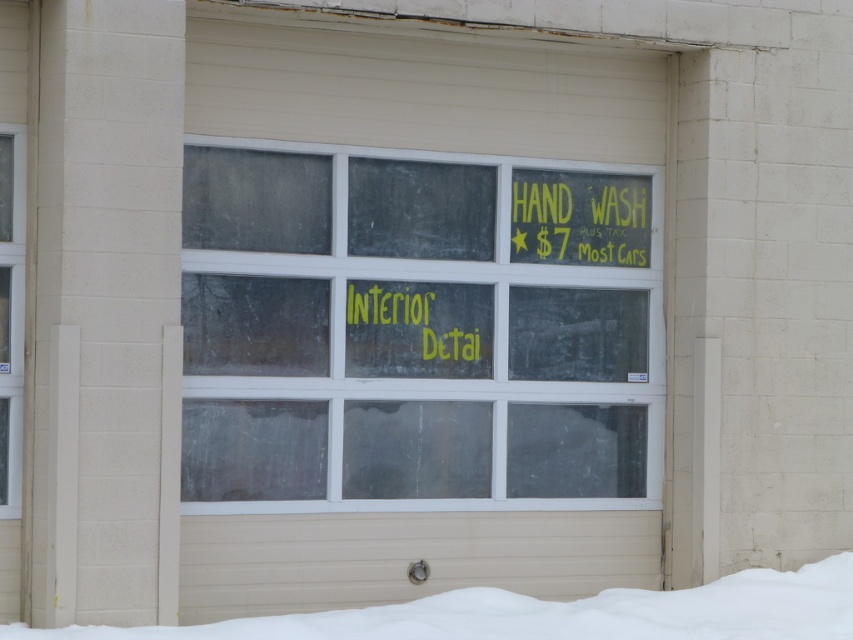
Question: Based on their relative distances, which object is nearer to the white fluffy snow at bottom?

Choices:
 (A) transparent glass window at center
 (B) yellow chalky sign at center
 (C) clear glass door at left
 (D) yellow chalkboard sign at upper right

Answer: (A)

Question: Is transparent glass window at center closer to the viewer compared to white fluffy snow at bottom?

Choices:
 (A) yes
 (B) no

Answer: (B)

Question: Is white fluffy snow at bottom smaller than yellow chalky sign at center?

Choices:
 (A) yes
 (B) no

Answer: (B)

Question: Which object is the closest to the clear glass door at left?

Choices:
 (A) transparent glass window at center
 (B) white fluffy snow at bottom
 (C) yellow chalkboard sign at upper right

Answer: (A)

Question: Among these objects, which one is nearest to the camera?

Choices:
 (A) yellow chalkboard sign at upper right
 (B) clear glass door at left

Answer: (B)

Question: Is white fluffy snow at bottom to the left of clear glass door at left from the viewer's perspective?

Choices:
 (A) yes
 (B) no

Answer: (B)